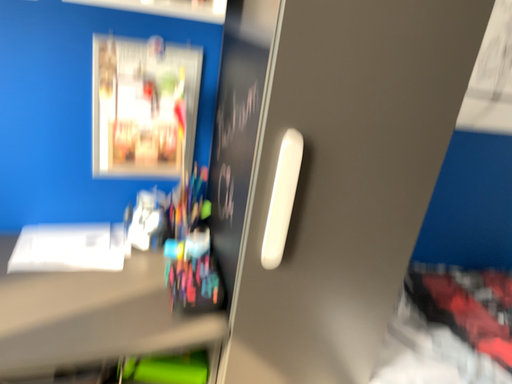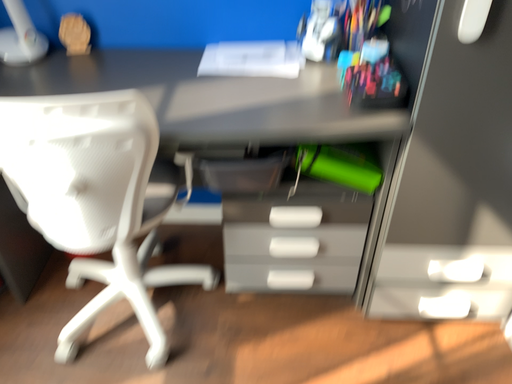
Question: Which way did the camera rotate in the video?

Choices:
 (A) rotated downward
 (B) rotated upward

Answer: (A)